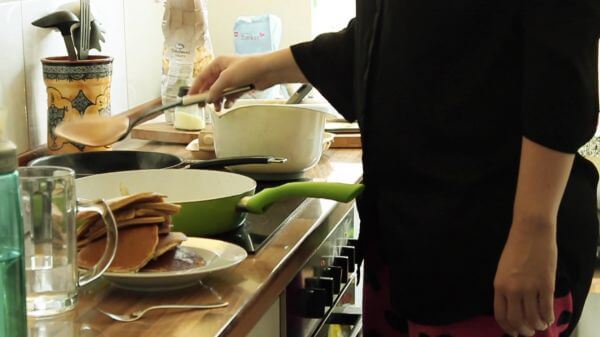
In order to click on mug handle in this screenshot , I will do `click(114, 234)`.